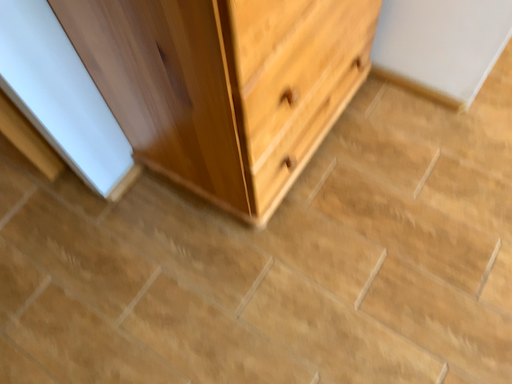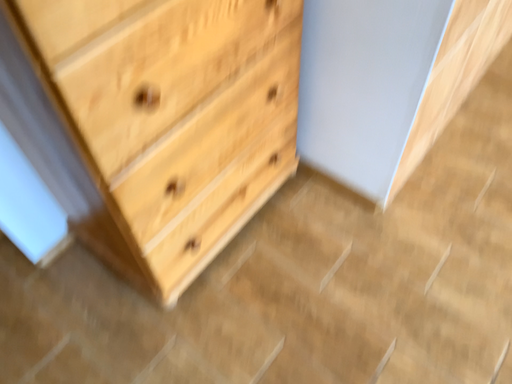
Question: How did the camera likely rotate when shooting the video?

Choices:
 (A) rotated downward
 (B) rotated upward

Answer: (B)